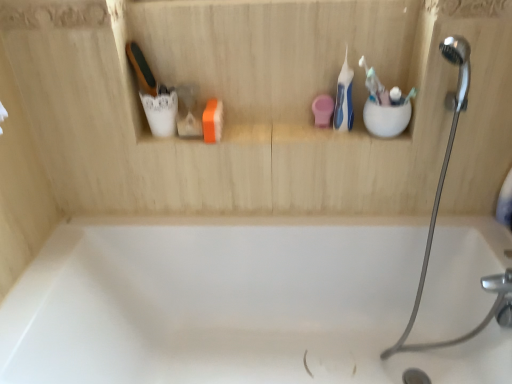
Question: Does blue plastic toothbrush at upper right, the 1th toothbrush from the left, have a lesser width compared to white glossy bathtub at center?

Choices:
 (A) no
 (B) yes

Answer: (B)

Question: Is white glossy bathtub at center at the back of blue plastic toothbrush at upper right, the 1th toothbrush from the left?

Choices:
 (A) no
 (B) yes

Answer: (A)

Question: Can we say blue plastic toothbrush at upper right, arranged as the 3th toothbrush when viewed from the right, lies outside white glossy bathtub at center?

Choices:
 (A) yes
 (B) no

Answer: (A)

Question: Can you confirm if blue plastic toothbrush at upper right, the 1th toothbrush from the left, is positioned to the left of white glossy bathtub at center?

Choices:
 (A) no
 (B) yes

Answer: (A)

Question: Is blue plastic toothbrush at upper right, the 1th toothbrush from the left, positioned behind white glossy bathtub at center?

Choices:
 (A) no
 (B) yes

Answer: (B)

Question: Can you confirm if blue plastic toothbrush at upper right, arranged as the 3th toothbrush when viewed from the right, is bigger than white glossy bathtub at center?

Choices:
 (A) yes
 (B) no

Answer: (B)

Question: Considering the relative positions of white plastic toothbrush at upper right, the second toothbrush when ordered from right to left, and silver metallic shower head at upper right in the image provided, is white plastic toothbrush at upper right, the second toothbrush when ordered from right to left, to the right of silver metallic shower head at upper right from the viewer's perspective?

Choices:
 (A) yes
 (B) no

Answer: (B)

Question: Is white plastic toothbrush at upper right, which is counted as the second toothbrush, starting from the left, positioned far away from silver metallic shower head at upper right?

Choices:
 (A) no
 (B) yes

Answer: (A)

Question: Considering the relative sizes of white plastic toothbrush at upper right, the second toothbrush when ordered from right to left, and silver metallic shower head at upper right in the image provided, is white plastic toothbrush at upper right, the second toothbrush when ordered from right to left, thinner than silver metallic shower head at upper right?

Choices:
 (A) no
 (B) yes

Answer: (B)

Question: Does white plastic toothbrush at upper right, the second toothbrush when ordered from right to left, come in front of silver metallic shower head at upper right?

Choices:
 (A) no
 (B) yes

Answer: (A)

Question: Is white plastic toothbrush at upper right, the second toothbrush when ordered from right to left, outside of silver metallic shower head at upper right?

Choices:
 (A) no
 (B) yes

Answer: (B)

Question: Can you confirm if white plastic toothbrush at upper right, which is counted as the second toothbrush, starting from the left, is wider than silver metallic shower head at upper right?

Choices:
 (A) yes
 (B) no

Answer: (B)

Question: Is the position of silver metallic shower head at upper right less distant than that of white plastic toothbrush at upper right, the second toothbrush when ordered from right to left?

Choices:
 (A) no
 (B) yes

Answer: (B)